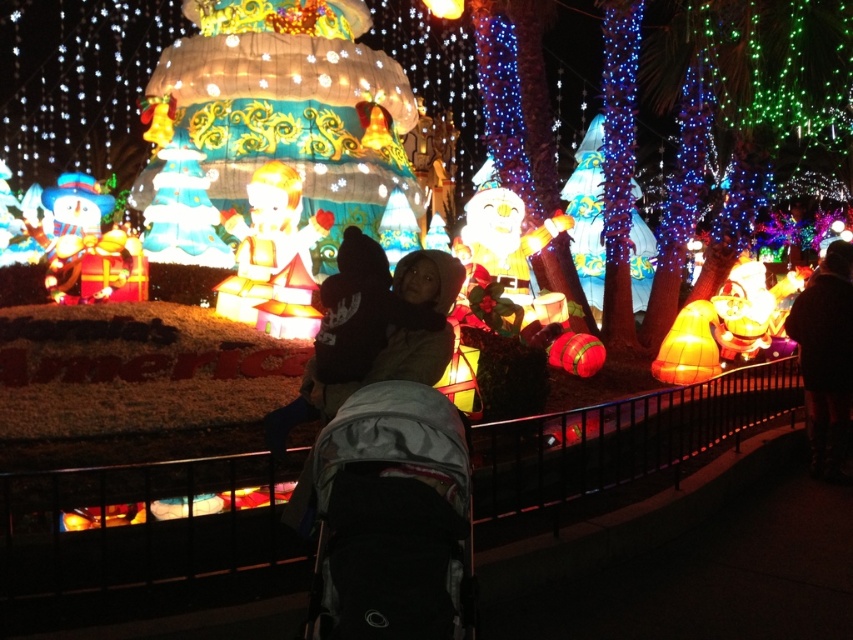
Question: Which point appears closest to the camera in this image?

Choices:
 (A) (334, 560)
 (B) (836, 326)

Answer: (A)

Question: Does gray fabric baby carriage at center have a smaller size compared to dark brown leather jacket at right?

Choices:
 (A) yes
 (B) no

Answer: (A)

Question: Which point appears farthest from the camera in this image?

Choices:
 (A) (834, 400)
 (B) (352, 500)

Answer: (A)

Question: Does gray fabric baby carriage at center appear on the right side of dark brown leather jacket at right?

Choices:
 (A) no
 (B) yes

Answer: (A)

Question: Does gray fabric baby carriage at center appear over dark brown leather jacket at right?

Choices:
 (A) no
 (B) yes

Answer: (A)